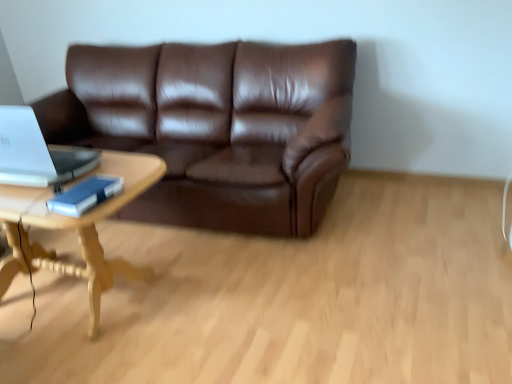
Question: Does blue matte book at left come in front of silver metallic laptop at left?

Choices:
 (A) no
 (B) yes

Answer: (B)

Question: Is blue matte book at left to the right of silver metallic laptop at left from the viewer's perspective?

Choices:
 (A) no
 (B) yes

Answer: (B)

Question: Does blue matte book at left turn towards silver metallic laptop at left?

Choices:
 (A) no
 (B) yes

Answer: (A)

Question: Is the position of blue matte book at left more distant than that of silver metallic laptop at left?

Choices:
 (A) yes
 (B) no

Answer: (B)

Question: From the image's perspective, would you say blue matte book at left is positioned over silver metallic laptop at left?

Choices:
 (A) no
 (B) yes

Answer: (A)

Question: Considering the relative positions of brown leather couch at center and silver metallic laptop at left in the image provided, is brown leather couch at center to the left or to the right of silver metallic laptop at left?

Choices:
 (A) right
 (B) left

Answer: (A)

Question: Is brown leather couch at center wider or thinner than silver metallic laptop at left?

Choices:
 (A) wide
 (B) thin

Answer: (A)

Question: From a real-world perspective, is brown leather couch at center positioned above or below silver metallic laptop at left?

Choices:
 (A) below
 (B) above

Answer: (A)

Question: Looking at the image, does brown leather couch at center seem bigger or smaller compared to silver metallic laptop at left?

Choices:
 (A) small
 (B) big

Answer: (B)

Question: Is blue matte book at left in front of or behind brown leather couch at center in the image?

Choices:
 (A) behind
 (B) front

Answer: (B)

Question: Choose the correct answer: Is blue matte book at left inside brown leather couch at center or outside it?

Choices:
 (A) inside
 (B) outside

Answer: (B)

Question: Considering the positions of blue matte book at left and brown leather couch at center in the image, is blue matte book at left wider or thinner than brown leather couch at center?

Choices:
 (A) wide
 (B) thin

Answer: (B)

Question: In terms of size, does blue matte book at left appear bigger or smaller than brown leather couch at center?

Choices:
 (A) small
 (B) big

Answer: (A)

Question: Visually, is light wood/woodencoffee table at left positioned to the left or to the right of brown leather couch at center?

Choices:
 (A) right
 (B) left

Answer: (B)

Question: Is light wood/woodencoffee table at left spatially inside brown leather couch at center, or outside of it?

Choices:
 (A) inside
 (B) outside

Answer: (B)